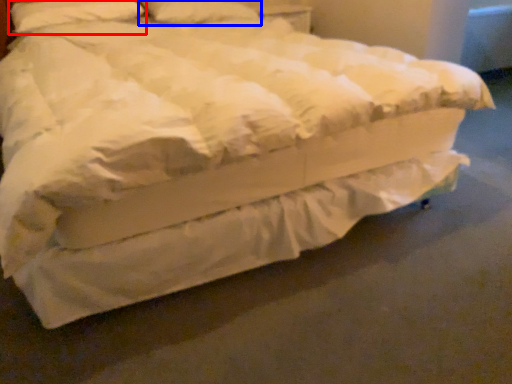
Question: Which object appears closest to the camera in this image, pillow (highlighted by a red box) or pillow (highlighted by a blue box)?

Choices:
 (A) pillow
 (B) pillow

Answer: (A)